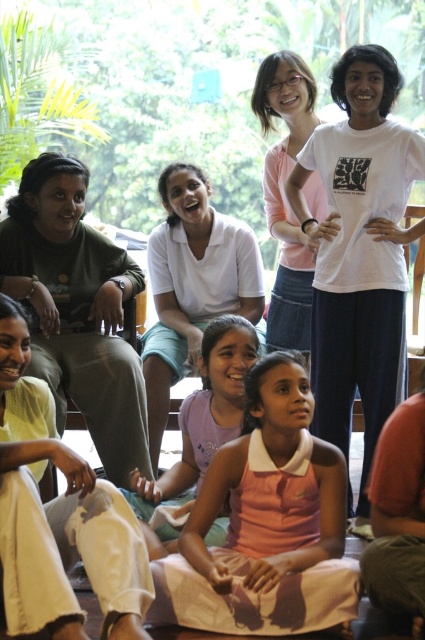
Is white cotton shirt at center bigger than pink fabric dress at center?

Yes, white cotton shirt at center is bigger than pink fabric dress at center.

Does white cotton shirt at center have a lesser height compared to pink fabric dress at center?

In fact, white cotton shirt at center may be taller than pink fabric dress at center.

Is point (170, 352) behind point (203, 355)?

Yes, it is behind point (203, 355).

Image resolution: width=425 pixels, height=640 pixels. I want to click on white cotton shirt at center, so click(192, 285).

Is pink cotton dress at center shorter than matte green shirt at left?

Yes.

Is point (263, 452) more distant than point (93, 356)?

No, (263, 452) is in front of (93, 356).

Who is more forward, (231,467) or (25,292)?

Point (231,467) is more forward.

You are a GUI agent. You are given a task and a screenshot of the screen. Output one action in this format:
    pyautogui.click(x=<x>, y=<y>)
    Task: Click on the pink cotton dress at center
    This screenshot has width=425, height=640.
    Given the screenshot: What is the action you would take?
    pyautogui.click(x=266, y=524)

Is point (173, 564) closer to camera compared to point (170, 483)?

That is True.

This screenshot has height=640, width=425. Describe the element at coordinates (266, 524) in the screenshot. I see `pink cotton dress at center` at that location.

Locate an element on the screen. The image size is (425, 640). pink cotton dress at center is located at coordinates [266, 524].